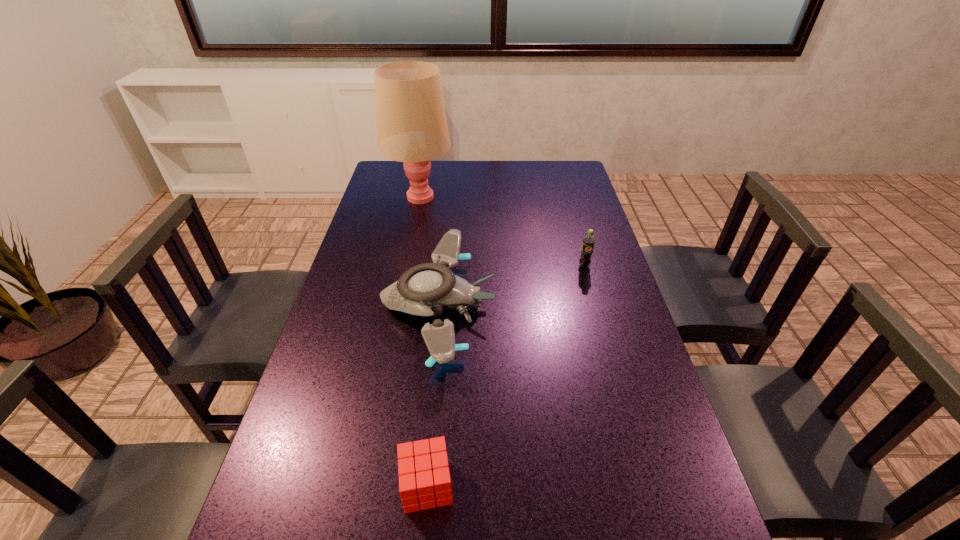
Identify the location of vacant area that lies between the lampshade and the second tallest object. Image resolution: width=960 pixels, height=540 pixels. (502, 232).

Image resolution: width=960 pixels, height=540 pixels. What are the coordinates of `vacant area that lies between the shortest object and the tallest object` in the screenshot? It's located at (423, 342).

The image size is (960, 540). I want to click on empty space between the second tallest object and the lampshade, so click(502, 232).

At what (x,y) coordinates should I click in order to perform the action: click on vacant region between the drone and the nearest object. Please return your answer as a coordinate pair (x, y). The width and height of the screenshot is (960, 540). Looking at the image, I should click on (433, 396).

You are a GUI agent. You are given a task and a screenshot of the screen. Output one action in this format:
    pyautogui.click(x=<x>, y=<y>)
    Task: Click on the vacant space that's between the nearest object and the second tallest object
    This screenshot has width=960, height=540.
    Given the screenshot: What is the action you would take?
    pyautogui.click(x=506, y=376)

At what (x,y) coordinates should I click in order to perform the action: click on object that is the closest one to the drone. Please return your answer as a coordinate pair (x, y). Looking at the image, I should click on (421, 473).

Locate an element on the screen. The height and width of the screenshot is (540, 960). object that is the closest to the nearest object is located at coordinates (427, 289).

At what (x,y) coordinates should I click in order to perform the action: click on free space that satisfies the following two spatial constraints: 1. on the front label of the soda; 2. on the front-facing side of the drone. Please return your answer as a coordinate pair (x, y). The width and height of the screenshot is (960, 540). Looking at the image, I should click on (595, 306).

This screenshot has height=540, width=960. I want to click on blank area in the image that satisfies the following two spatial constraints: 1. on the front-facing side of the drone; 2. on the back side of the cube, so pos(420,485).